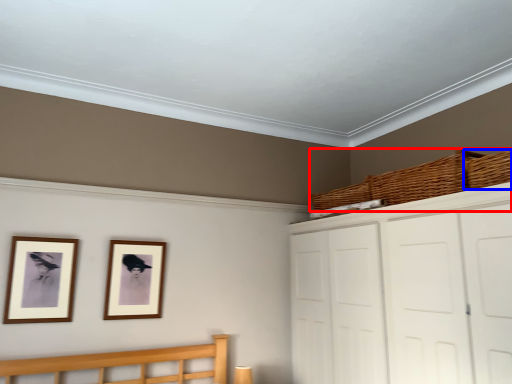
Question: Which object appears farthest to the camera in this image, basket (highlighted by a red box) or basket (highlighted by a blue box)?

Choices:
 (A) basket
 (B) basket

Answer: (A)